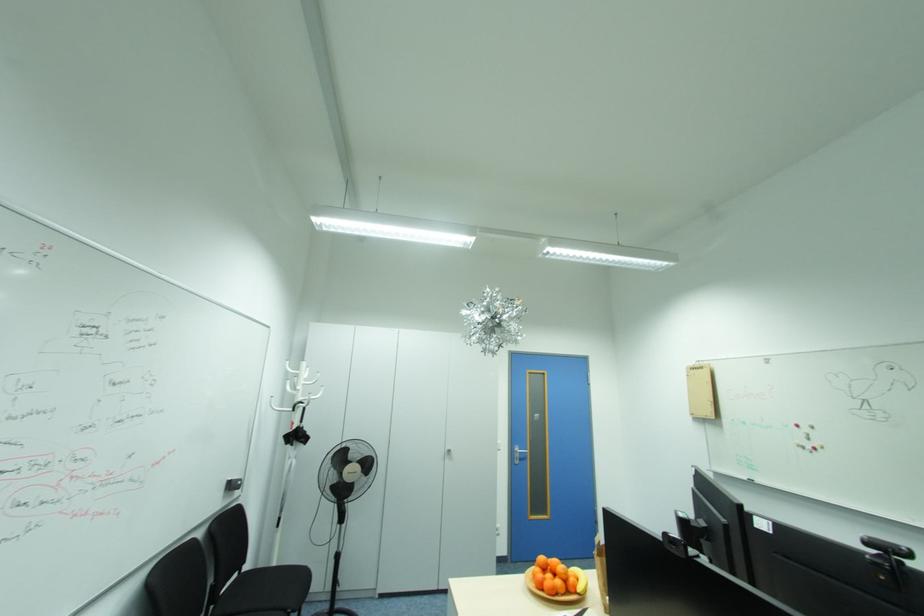
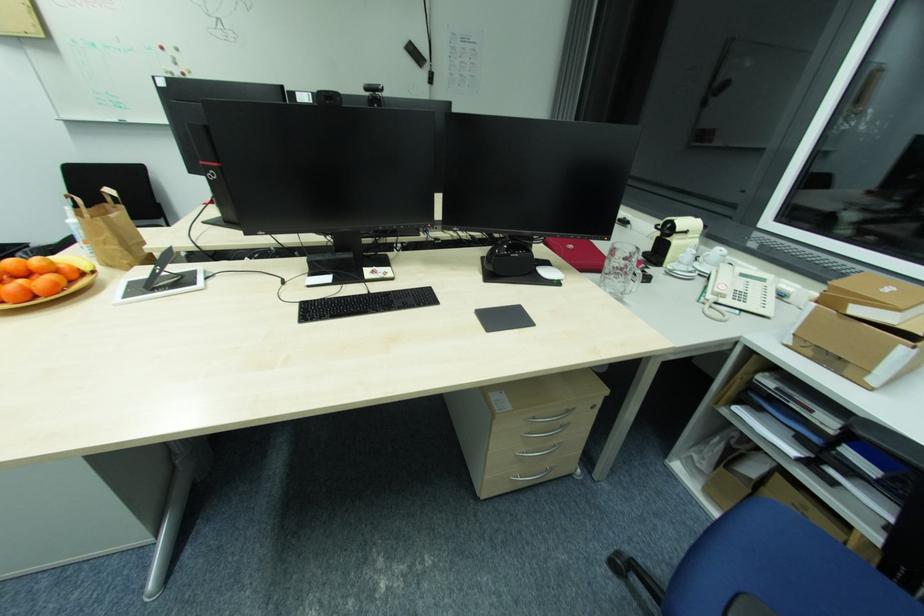
How did the camera likely rotate?

The camera rotated toward right-down.